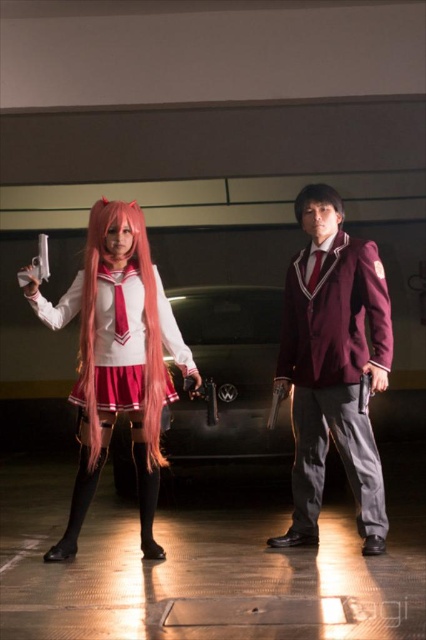
Question: Considering the relative positions of matte pink wig at center and pink silky wig at center in the image provided, where is matte pink wig at center located with respect to pink silky wig at center?

Choices:
 (A) right
 (B) left

Answer: (B)

Question: Among these points, which one is nearest to the camera?

Choices:
 (A) [x=314, y=435]
 (B) [x=92, y=268]
 (C) [x=92, y=358]

Answer: (C)

Question: Is the position of matte pink wig at center less distant than that of pink silky wig at center?

Choices:
 (A) no
 (B) yes

Answer: (B)

Question: Does maroon fabric suit at center come behind pink silky wig at center?

Choices:
 (A) yes
 (B) no

Answer: (B)

Question: Which object is positioned farthest from the black silky hair at center?

Choices:
 (A) matte pink wig at center
 (B) matte pink wig at left

Answer: (A)

Question: Which point is closer to the camera taking this photo?

Choices:
 (A) (324, 227)
 (B) (331, 243)
 (C) (94, 417)

Answer: (C)